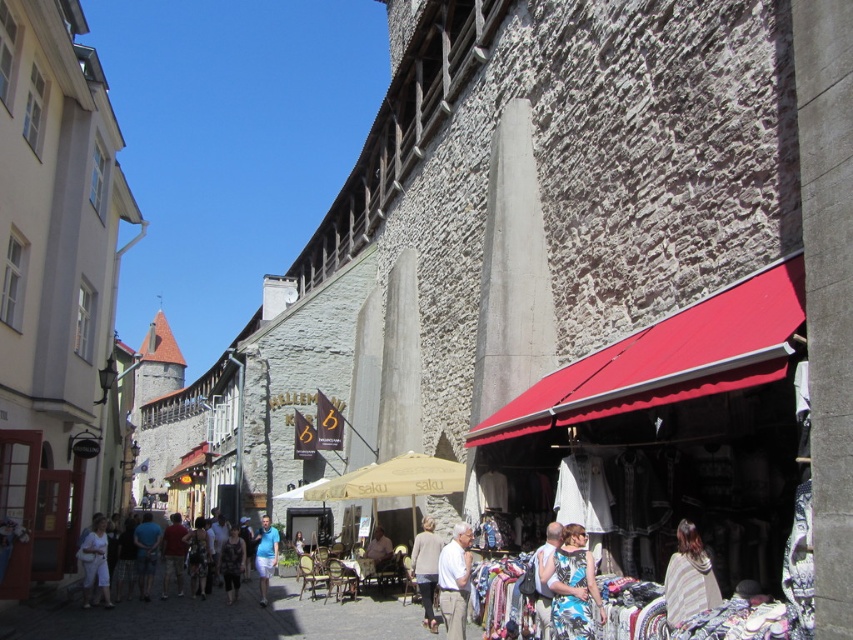
Does white cotton dress at lower left appear on the left side of light brown leather jacket at lower center?

Yes, white cotton dress at lower left is to the left of light brown leather jacket at lower center.

Which is in front, point (102, 557) or point (541, 563)?

Point (541, 563)

Locate an element on the screen. The image size is (853, 640). white cotton dress at lower left is located at coordinates (96, 561).

Can you confirm if red fabric awning at center is thinner than dark gray fabric dress at center?

No, red fabric awning at center is not thinner than dark gray fabric dress at center.

Is point (572, 381) closer to viewer compared to point (231, 529)?

That is True.

Is point (779, 333) closer to camera compared to point (239, 570)?

Yes, it is in front of point (239, 570).

This screenshot has height=640, width=853. In order to click on red fabric awning at center in this screenshot , I will do `click(666, 356)`.

Is blue floral dress at center to the right of dark gray fabric dress at center from the viewer's perspective?

Yes, blue floral dress at center is to the right of dark gray fabric dress at center.

Is point (572, 531) farther from camera compared to point (221, 554)?

That is False.

Between point (587, 573) and point (242, 556), which one is positioned behind?

The point (242, 556) is more distant.

Find the location of a particular element. This screenshot has width=853, height=640. blue floral dress at center is located at coordinates pyautogui.click(x=573, y=586).